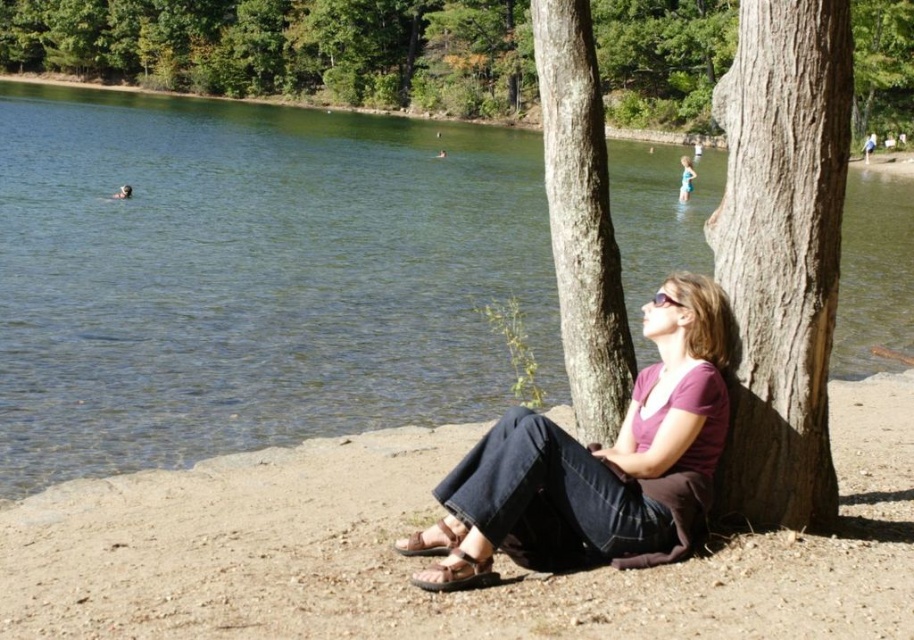
Question: Among these objects, which one is farthest from the camera?

Choices:
 (A) smooth brown bark at center
 (B) green water at lake center
 (C) smooth brown tree trunk at center

Answer: (A)

Question: Which point appears farthest from the camera in this image?

Choices:
 (A) (803, 284)
 (B) (586, 333)
 (C) (687, 161)

Answer: (C)

Question: Is purple matte shirt at center to the right of smooth brown bark at center from the viewer's perspective?

Choices:
 (A) yes
 (B) no

Answer: (B)

Question: Considering the relative positions of green water at lake center and brown textured tree at center in the image provided, where is green water at lake center located with respect to brown textured tree at center?

Choices:
 (A) below
 (B) above

Answer: (A)

Question: Does purple matte shirt at center have a greater width compared to light blue swimsuit at center?

Choices:
 (A) yes
 (B) no

Answer: (B)

Question: Which point appears farthest from the camera in this image?

Choices:
 (A) (110, 22)
 (B) (689, 182)
 (C) (34, 113)

Answer: (A)